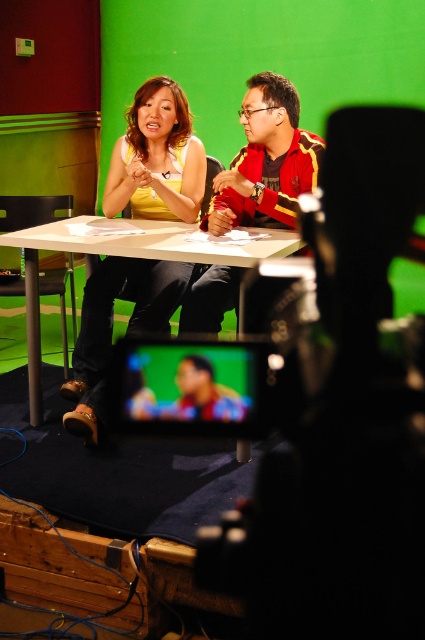
Is point (175, 108) behind point (201, 385)?

Yes, point (175, 108) is behind point (201, 385).

Can you confirm if yellow fabric top at center is taller than matte plastic screen at center?

Yes.

This screenshot has height=640, width=425. Identify the location of yellow fabric top at center. (156, 157).

Does red-yellow striped shirt at center have a greater width compared to white plastic table at center?

No, red-yellow striped shirt at center is not wider than white plastic table at center.

Does point (243, 115) come closer to viewer compared to point (39, 403)?

Yes, point (243, 115) is closer to viewer.

Locate an element on the screen. The width and height of the screenshot is (425, 640). red-yellow striped shirt at center is located at coordinates (266, 161).

Which is more to the left, yellow fabric top at center or white plastic table at center?

From the viewer's perspective, white plastic table at center appears more on the left side.

Find the location of a particular element. This screenshot has height=640, width=425. yellow fabric top at center is located at coordinates (156, 157).

Where is `yellow fabric top at center`? yellow fabric top at center is located at coordinates (156, 157).

This screenshot has height=640, width=425. I want to click on yellow fabric top at center, so click(156, 157).